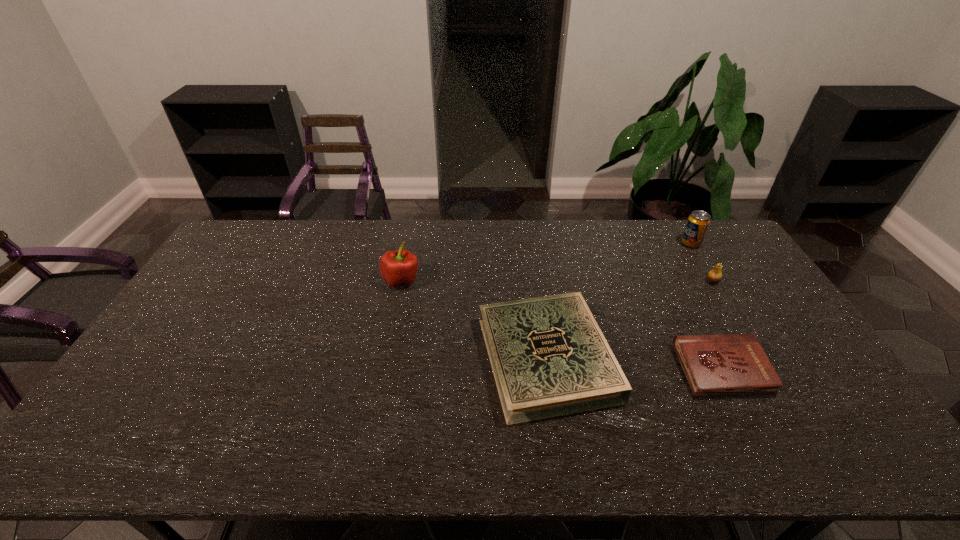
The image size is (960, 540). In order to click on vacant point located between the shorter hardback book and the fourth object from right to left in this screenshot , I will do click(x=635, y=364).

Find the location of `blank region between the shortest object and the third shortest object`. blank region between the shortest object and the third shortest object is located at coordinates (717, 326).

What are the coordinates of `unoccupied area between the third shortest object and the right hardback book` in the screenshot? It's located at pos(717,326).

The image size is (960, 540). What are the coordinates of `empty space that is in between the shorter hardback book and the farthest object` in the screenshot? It's located at (x=707, y=307).

Where is `empty space between the pear and the shortest object`? The height and width of the screenshot is (540, 960). empty space between the pear and the shortest object is located at coordinates (717, 326).

Image resolution: width=960 pixels, height=540 pixels. I want to click on free space between the fourth object from right to left and the shorter hardback book, so coord(635,364).

The width and height of the screenshot is (960, 540). In order to click on free space between the pear and the shorter hardback book in this screenshot , I will do [717, 326].

At what (x,y) coordinates should I click in order to perform the action: click on free space between the shortest object and the second shortest object. Please return your answer as a coordinate pair (x, y). Looking at the image, I should click on (635, 364).

What are the coordinates of `vacant point located between the bell pepper and the pear` in the screenshot? It's located at (557, 281).

Locate an element on the screen. This screenshot has height=540, width=960. empty space that is in between the second object from left to right and the third tallest object is located at coordinates (630, 320).